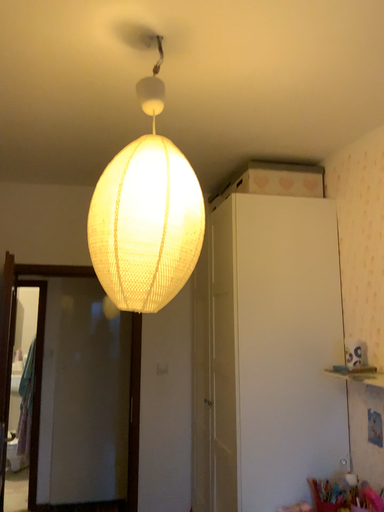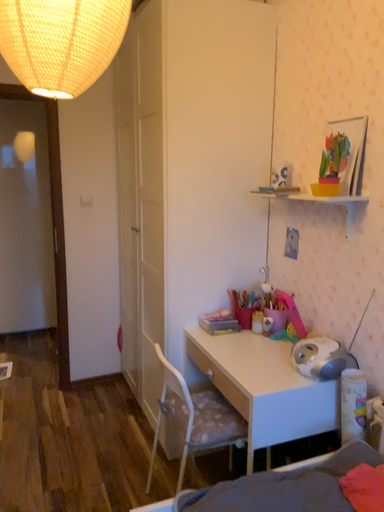
Question: How did the camera likely rotate when shooting the video?

Choices:
 (A) rotated right
 (B) rotated left

Answer: (A)